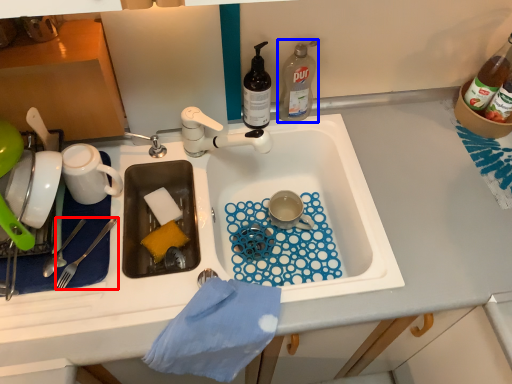
Question: Which object is further to the camera taking this photo, fork (highlighted by a red box) or bottle (highlighted by a blue box)?

Choices:
 (A) fork
 (B) bottle

Answer: (B)